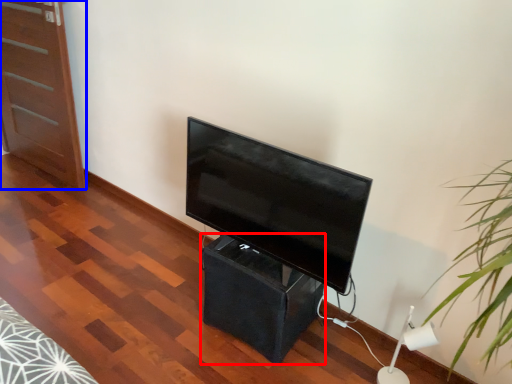
Question: Which point is closer to the camera, table (highlighted by a red box) or furniture (highlighted by a blue box)?

Choices:
 (A) table
 (B) furniture

Answer: (A)